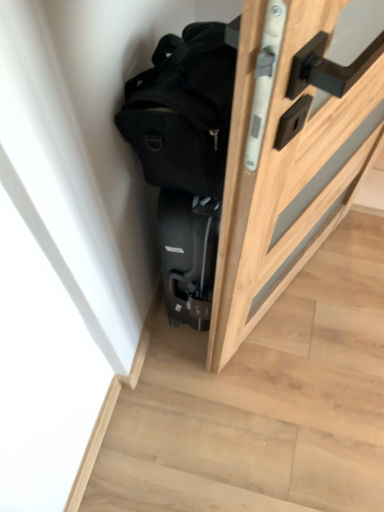
Question: Is black suitcase at lower left looking in the opposite direction of wooden door at right?

Choices:
 (A) yes
 (B) no

Answer: (B)

Question: Does black suitcase at lower left have a smaller size compared to wooden door at right?

Choices:
 (A) yes
 (B) no

Answer: (A)

Question: Can you confirm if black suitcase at lower left is thinner than wooden door at right?

Choices:
 (A) yes
 (B) no

Answer: (B)

Question: Is black suitcase at lower left located outside wooden door at right?

Choices:
 (A) no
 (B) yes

Answer: (B)

Question: Can you confirm if black suitcase at lower left is shorter than wooden door at right?

Choices:
 (A) yes
 (B) no

Answer: (A)

Question: Based on their positions, is black matte backpack at upper center located to the left or right of black suitcase at lower left?

Choices:
 (A) right
 (B) left

Answer: (B)

Question: Relative to black suitcase at lower left, is black matte backpack at upper center in front or behind?

Choices:
 (A) behind
 (B) front

Answer: (B)

Question: Choose the correct answer: Is black matte backpack at upper center inside black suitcase at lower left or outside it?

Choices:
 (A) inside
 (B) outside

Answer: (B)

Question: Is black matte backpack at upper center taller or shorter than black suitcase at lower left?

Choices:
 (A) short
 (B) tall

Answer: (B)

Question: Is wooden door at right in front of or behind black matte backpack at upper center in the image?

Choices:
 (A) behind
 (B) front

Answer: (A)

Question: In the image, is wooden door at right on the left side or the right side of black matte backpack at upper center?

Choices:
 (A) right
 (B) left

Answer: (A)

Question: In terms of size, does wooden door at right appear bigger or smaller than black matte backpack at upper center?

Choices:
 (A) big
 (B) small

Answer: (A)

Question: From their relative heights in the image, would you say wooden door at right is taller or shorter than black matte backpack at upper center?

Choices:
 (A) short
 (B) tall

Answer: (B)

Question: Considering their positions, is black suitcase at lower left located in front of or behind black matte backpack at upper center?

Choices:
 (A) behind
 (B) front

Answer: (A)

Question: From the image's perspective, is black suitcase at lower left located above or below black matte backpack at upper center?

Choices:
 (A) below
 (B) above

Answer: (A)